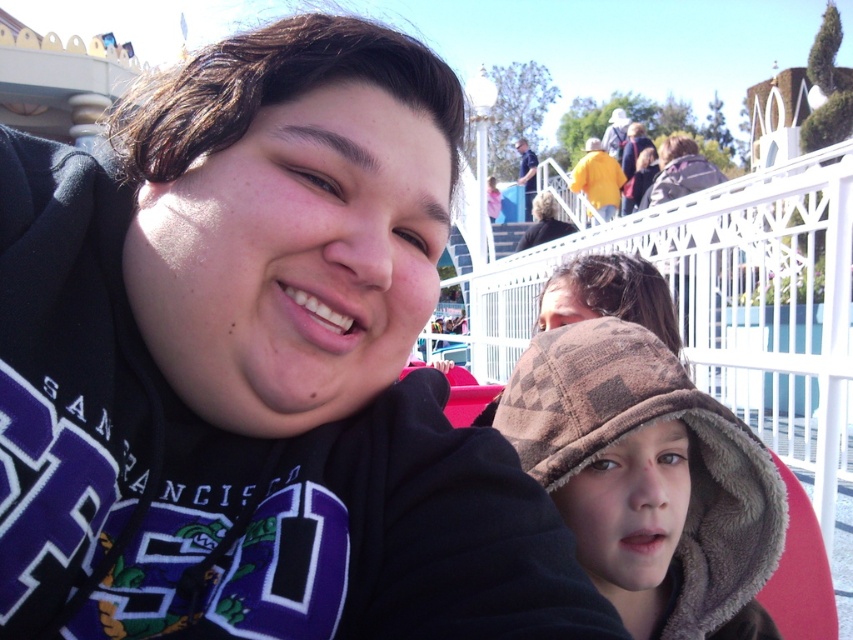
You are a photographer trying to capture the scene with a wide angle lens. You want to ensure both the brown fleece hat at center and the dark brown hair at upper center are in focus. Which object should you focus on first to ensure both are sharp?

The brown fleece hat at center is positioned on the left side of dark brown hair at upper center. To ensure both are in focus, you should focus on the brown fleece hat at center first since it is closer to the camera compared to the dark brown hair at upper center.

You are a photographer trying to capture a clear shot of both the brown fleece hat at center and the dark brown hair at upper center. Which object should you focus on first to ensure both are in focus?

You should focus on the brown fleece hat at center first since it is closer to the viewer than the dark brown hair at upper center. By focusing on the closer object, the farther one will also be in focus due to the depth of field.

In the scene shown: You are a photographer trying to capture a clear shot of both the brown fleece hat at center and the dark brown hair at upper center. Which object would appear narrower in your photo?

The brown fleece hat at center is thinner than the dark brown hair at upper center, so it would appear narrower in the photo.